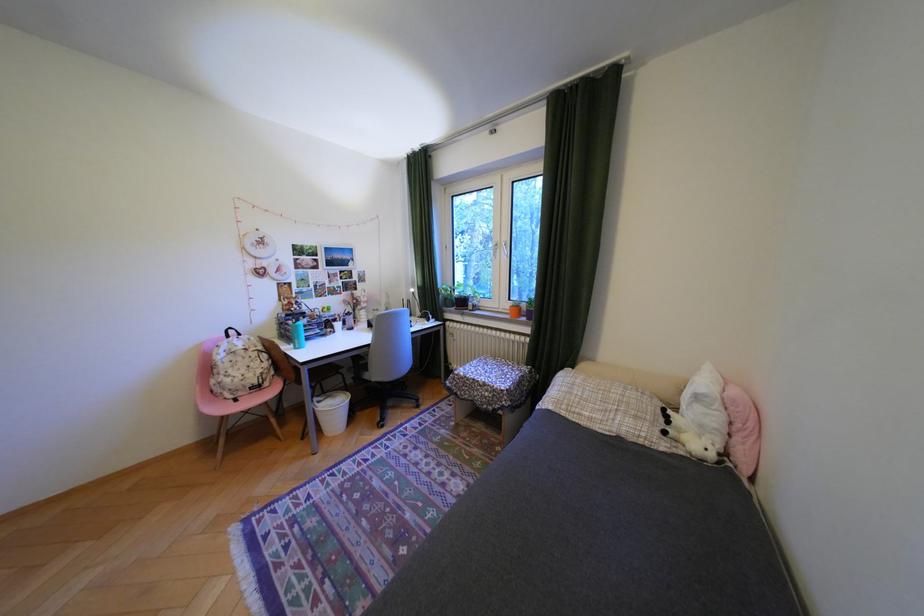
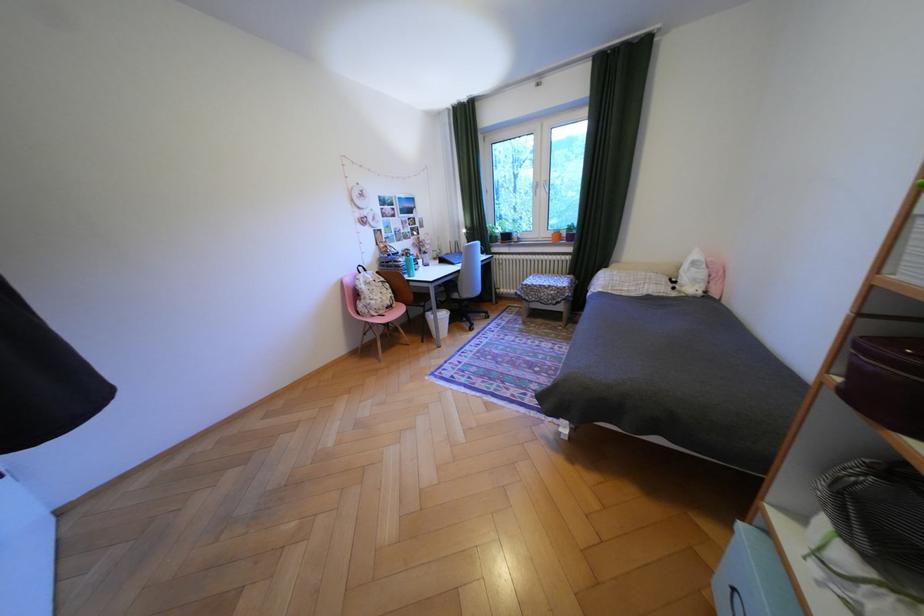
In the second image, find the point that corresponds to point 723,456 in the first image.

(712, 293)